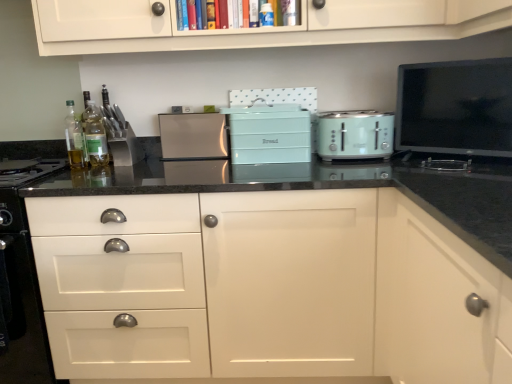
Looking at this image, what is the approximate height of matte teal bread bin at center, acting as the first appliance starting from the left?

matte teal bread bin at center, acting as the first appliance starting from the left, is 9.66 inches tall.

Describe the element at coordinates (95, 136) in the screenshot. The image size is (512, 384). I see `clear glass bottle at left, which appears as the first bottle when viewed from the right` at that location.

What is the approximate height of satin silver toaster at center, which appears as the first kitchen appliance when viewed from the left?

satin silver toaster at center, which appears as the first kitchen appliance when viewed from the left, is 9.29 inches tall.

Measure the distance between point (83, 274) and camera.

The distance of point (83, 274) from camera is 1.51 meters.

This screenshot has height=384, width=512. What are the coordinates of `white matte cabinet at center` in the screenshot? It's located at (266, 288).

Identify the location of matte teal bread bin at center, the second appliance in the right-to-left sequence. The image size is (512, 384). (269, 133).

Is matte teal bread bin at center, the second appliance in the right-to-left sequence, oriented towards white matte cabinet at center?

No, matte teal bread bin at center, the second appliance in the right-to-left sequence, is not oriented towards white matte cabinet at center.

Does matte teal bread bin at center, the second appliance in the right-to-left sequence, have a greater width compared to white matte cabinet at center?

No, matte teal bread bin at center, the second appliance in the right-to-left sequence, is not wider than white matte cabinet at center.

Find the location of a particular element. cabinetry below the matte teal bread bin at center, acting as the first appliance starting from the left (from the image's perspective) is located at coordinates (266, 288).

From the image's perspective, which object appears higher, matte teal bread bin at center, acting as the first appliance starting from the left, or white matte cabinet at center?

matte teal bread bin at center, acting as the first appliance starting from the left, from the image's perspective.

Identify the location of appliance located on the right of white matte cabinet at center. This screenshot has height=384, width=512. (455, 108).

Is point (460, 152) closer to viewer compared to point (364, 210)?

No.

From a real-world perspective, is black glossy tv at upper right, the 1th appliance in the right-to-left sequence, below white matte cabinet at center?

No, from a real-world perspective, black glossy tv at upper right, the 1th appliance in the right-to-left sequence, is not below white matte cabinet at center.

From the image's perspective, is black glossy tv at upper right, arranged as the 2th appliance when viewed from the left, over white matte cabinet at center?

Yes, from the image's perspective, black glossy tv at upper right, arranged as the 2th appliance when viewed from the left, is over white matte cabinet at center.

Is black glossy tv at upper right, arranged as the 2th appliance when viewed from the left, aimed at clear glass bottle at left, which appears as the first bottle when viewed from the right?

No.

Who is smaller, black glossy tv at upper right, the 1th appliance in the right-to-left sequence, or clear glass bottle at left, which appears as the first bottle when viewed from the right?

clear glass bottle at left, which appears as the first bottle when viewed from the right.

Is black glossy tv at upper right, the 1th appliance in the right-to-left sequence, far away from clear glass bottle at left, which appears as the first bottle when viewed from the right?

Absolutely, black glossy tv at upper right, the 1th appliance in the right-to-left sequence, is distant from clear glass bottle at left, which appears as the first bottle when viewed from the right.

From the image's perspective, is black glossy tv at upper right, the 1th appliance in the right-to-left sequence, beneath clear glass bottle at left, which appears as the first bottle when viewed from the right?

Incorrect, from the image's perspective, black glossy tv at upper right, the 1th appliance in the right-to-left sequence, is higher than clear glass bottle at left, which appears as the first bottle when viewed from the right.

Based on the photo, could you measure the distance between white matte cabinet at center and clear glass bottle at left, which appears as the first bottle when viewed from the right?

30.52 inches.

Is white matte cabinet at center next to clear glass bottle at left, which appears as the first bottle when viewed from the right?

white matte cabinet at center is not next to clear glass bottle at left, which appears as the first bottle when viewed from the right, and they're not touching.

Locate an element on the screen. Image resolution: width=512 pixels, height=384 pixels. cabinetry that appears below the clear glass bottle at left, which appears as the first bottle when viewed from the right (from the image's perspective) is located at coordinates (266, 288).

How different are the orientations of white matte cabinet at center and clear glass bottle at left, the 2th bottle in the left-to-right sequence, in degrees?

3.47 degrees separate the facing orientations of white matte cabinet at center and clear glass bottle at left, the 2th bottle in the left-to-right sequence.

Is mint green plastic toaster at center, the second kitchen appliance in the left-to-right sequence, facing away from clear glass bottle at left, which appears as the first bottle when viewed from the right?

That's not correct — mint green plastic toaster at center, the second kitchen appliance in the left-to-right sequence, is not looking away from clear glass bottle at left, which appears as the first bottle when viewed from the right.

Is mint green plastic toaster at center, marked as the first kitchen appliance in a front-to-back arrangement, positioned far away from clear glass bottle at left, which appears as the first bottle when viewed from the right?

Indeed, mint green plastic toaster at center, marked as the first kitchen appliance in a front-to-back arrangement, is not near clear glass bottle at left, which appears as the first bottle when viewed from the right.

Is mint green plastic toaster at center, the 1th kitchen appliance viewed from the right, spatially inside clear glass bottle at left, which appears as the first bottle when viewed from the right, or outside of it?

mint green plastic toaster at center, the 1th kitchen appliance viewed from the right, cannot be found inside clear glass bottle at left, which appears as the first bottle when viewed from the right.

Is mint green plastic toaster at center, the 2th kitchen appliance when ordered from back to front, taller than clear glass bottle at left, the 2th bottle in the left-to-right sequence?

No, mint green plastic toaster at center, the 2th kitchen appliance when ordered from back to front, is not taller than clear glass bottle at left, the 2th bottle in the left-to-right sequence.

Is black glossy tv at upper right, the 1th appliance in the right-to-left sequence, smaller than white glossy drawer at lower left?

Indeed, black glossy tv at upper right, the 1th appliance in the right-to-left sequence, has a smaller size compared to white glossy drawer at lower left.

How many degrees apart are the facing directions of black glossy tv at upper right, arranged as the 2th appliance when viewed from the left, and white glossy drawer at lower left?

There is a 38.2-degree angle between the facing directions of black glossy tv at upper right, arranged as the 2th appliance when viewed from the left, and white glossy drawer at lower left.

Is black glossy tv at upper right, arranged as the 2th appliance when viewed from the left, facing towards white glossy drawer at lower left?

No.

Would you say matte teal bread bin at center, acting as the first appliance starting from the left, is inside or outside black glossy tv at upper right, the 1th appliance in the right-to-left sequence?

matte teal bread bin at center, acting as the first appliance starting from the left, is outside black glossy tv at upper right, the 1th appliance in the right-to-left sequence.

Is matte teal bread bin at center, the second appliance in the right-to-left sequence, facing away from black glossy tv at upper right, arranged as the 2th appliance when viewed from the left?

No, matte teal bread bin at center, the second appliance in the right-to-left sequence, is not facing away from black glossy tv at upper right, arranged as the 2th appliance when viewed from the left.

Considering the points (270, 157) and (509, 109), which point is in front, point (270, 157) or point (509, 109)?

Positioned in front is point (509, 109).

How many degrees apart are the facing directions of matte teal bread bin at center, acting as the first appliance starting from the left, and black glossy tv at upper right, the 1th appliance in the right-to-left sequence?

matte teal bread bin at center, acting as the first appliance starting from the left, and black glossy tv at upper right, the 1th appliance in the right-to-left sequence, are facing 37.4 degrees away from each other.

I want to click on appliance that is the 1st object located above the white matte cabinet at center (from the image's perspective), so click(x=269, y=133).

Locate an element on the screen. cabinetry below the black glossy tv at upper right, arranged as the 2th appliance when viewed from the left (from a real-world perspective) is located at coordinates (266, 288).

Estimate the real-world distances between objects in this image. Which object is closer to translucent glass bottle at left, the 1th bottle in the left-to-right sequence, clear glass bottle at left, the 2th bottle in the left-to-right sequence, or mint green plastic toaster at center, marked as the first kitchen appliance in a front-to-back arrangement?

clear glass bottle at left, the 2th bottle in the left-to-right sequence, is positioned closer to the anchor translucent glass bottle at left, the 1th bottle in the left-to-right sequence.

Based on their spatial positions, is satin silver toaster at center, which is the 2th kitchen appliance in right-to-left order, or white glossy drawer at lower left closer to clear glass bottle at left, which appears as the first bottle when viewed from the right?

Among the two, satin silver toaster at center, which is the 2th kitchen appliance in right-to-left order, is located nearer to clear glass bottle at left, which appears as the first bottle when viewed from the right.

Based on the photo, estimate the real-world distances between objects in this image. Which object is further from clear glass bottle at left, which appears as the first bottle when viewed from the right, satin silver toaster at center, the first kitchen appliance viewed from the back, or translucent glass bottle at left, the 1th bottle in the left-to-right sequence?

Based on the image, satin silver toaster at center, the first kitchen appliance viewed from the back, appears to be further to clear glass bottle at left, which appears as the first bottle when viewed from the right.

Estimate the real-world distances between objects in this image. Which object is further from matte teal bread bin at center, acting as the first appliance starting from the left, black glossy tv at upper right, arranged as the 2th appliance when viewed from the left, or white glossy drawer at lower left?

white glossy drawer at lower left is further to matte teal bread bin at center, acting as the first appliance starting from the left.

Looking at the image, which one is located closer to mint green plastic toaster at center, the 2th kitchen appliance when ordered from back to front, clear glass bottle at left, which appears as the first bottle when viewed from the right, or matte teal bread bin at center, the second appliance in the right-to-left sequence?

Based on the image, matte teal bread bin at center, the second appliance in the right-to-left sequence, appears to be nearer to mint green plastic toaster at center, the 2th kitchen appliance when ordered from back to front.

Estimate the real-world distances between objects in this image. Which object is further from white matte cabinet at center, matte teal bread bin at center, the second appliance in the right-to-left sequence, or satin silver toaster at center, the first kitchen appliance viewed from the back?

satin silver toaster at center, the first kitchen appliance viewed from the back.

Looking at the image, which one is located closer to white matte cabinet at center, clear glass bottle at left, which appears as the first bottle when viewed from the right, or black glossy tv at upper right, arranged as the 2th appliance when viewed from the left?

Based on the image, black glossy tv at upper right, arranged as the 2th appliance when viewed from the left, appears to be nearer to white matte cabinet at center.

Estimate the real-world distances between objects in this image. Which object is further from translucent glass bottle at left, positioned as the 2th bottle in right-to-left order, white matte cabinet at center or satin silver toaster at center, the first kitchen appliance viewed from the back?

Based on the image, white matte cabinet at center appears to be further to translucent glass bottle at left, positioned as the 2th bottle in right-to-left order.

The width and height of the screenshot is (512, 384). Identify the location of kitchen appliance situated between clear glass bottle at left, the 2th bottle in the left-to-right sequence, and matte teal bread bin at center, the second appliance in the right-to-left sequence, from left to right. (193, 136).

Find the location of `cabinetry located between clear glass bottle at left, the 2th bottle in the left-to-right sequence, and mint green plastic toaster at center, the 1th kitchen appliance viewed from the right, in the left-right direction`. cabinetry located between clear glass bottle at left, the 2th bottle in the left-to-right sequence, and mint green plastic toaster at center, the 1th kitchen appliance viewed from the right, in the left-right direction is located at coordinates [266, 288].

Where is `cabinetry between satin silver toaster at center, the first kitchen appliance viewed from the back, and black glossy tv at upper right, the 1th appliance in the right-to-left sequence`? The image size is (512, 384). cabinetry between satin silver toaster at center, the first kitchen appliance viewed from the back, and black glossy tv at upper right, the 1th appliance in the right-to-left sequence is located at coordinates (266, 288).

Where is `kitchen appliance located between satin silver toaster at center, which is the 2th kitchen appliance in right-to-left order, and black glossy tv at upper right, the 1th appliance in the right-to-left sequence, in the left-right direction`? kitchen appliance located between satin silver toaster at center, which is the 2th kitchen appliance in right-to-left order, and black glossy tv at upper right, the 1th appliance in the right-to-left sequence, in the left-right direction is located at coordinates (354, 134).